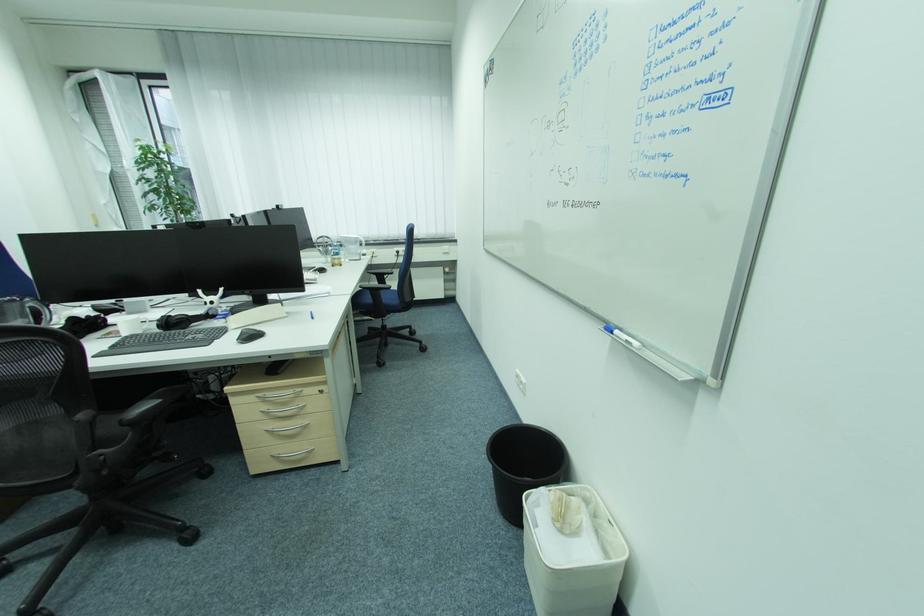
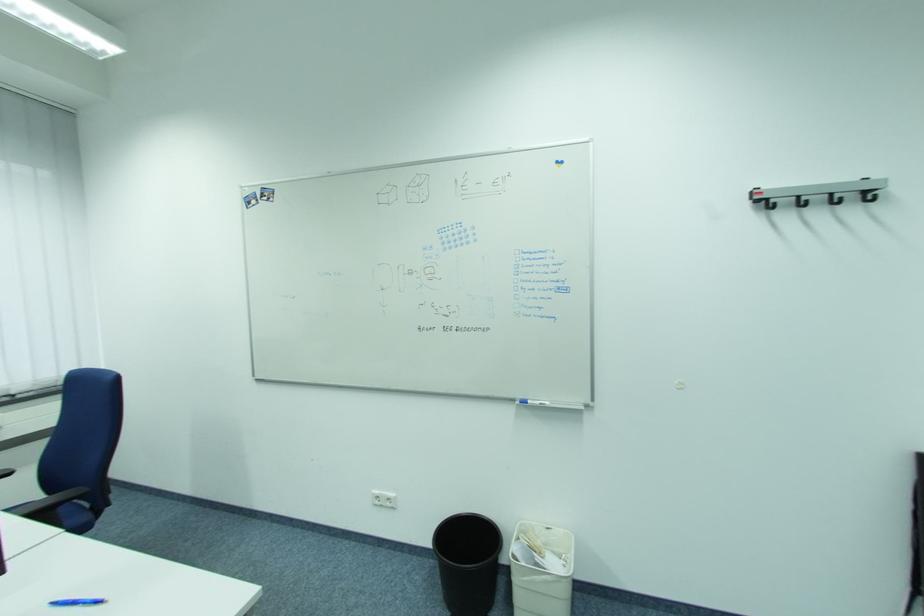
Where in the second image is the point corresponding to point 618,334 from the first image?

(533, 403)